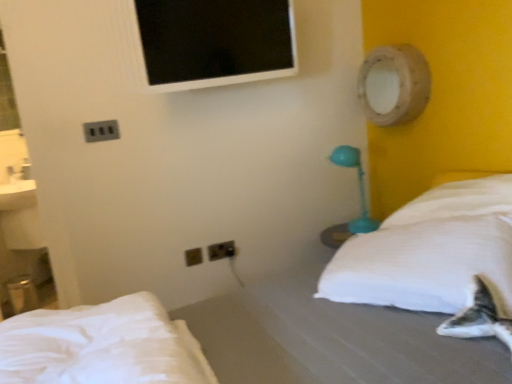
This screenshot has height=384, width=512. Find the location of `metallic socket at upper left, which is the first electric outlet from front to back`. metallic socket at upper left, which is the first electric outlet from front to back is located at coordinates (101, 131).

The height and width of the screenshot is (384, 512). Describe the element at coordinates (101, 131) in the screenshot. I see `metallic socket at upper left, which is the third electric outlet in bottom-to-top order` at that location.

What are the coordinates of `black plastic electric outlet at lower center, which ranks as the 2th electric outlet in right-to-left order` in the screenshot? It's located at (193, 257).

Identify the location of white fabric bed at center, positioned as the 2th bed in top-to-bottom order. This screenshot has width=512, height=384. (248, 340).

Is black plastic outlet at lower center, which is the second electric outlet in bottom-to-top order, wider or thinner than black plastic electric outlet at lower center, which ranks as the 2th electric outlet in right-to-left order?

black plastic outlet at lower center, which is the second electric outlet in bottom-to-top order, is thinner than black plastic electric outlet at lower center, which ranks as the 2th electric outlet in right-to-left order.

Is black plastic outlet at lower center, the 1th electric outlet positioned from the right, to the left or to the right of black plastic electric outlet at lower center, the second electric outlet viewed from the back, in the image?

Clearly, black plastic outlet at lower center, the 1th electric outlet positioned from the right, is on the right of black plastic electric outlet at lower center, the second electric outlet viewed from the back, in the image.

Choose the correct answer: Is black plastic outlet at lower center, marked as the third electric outlet in a left-to-right arrangement, inside black plastic electric outlet at lower center, which is counted as the 2th electric outlet, starting from the left, or outside it?

black plastic outlet at lower center, marked as the third electric outlet in a left-to-right arrangement, lies outside black plastic electric outlet at lower center, which is counted as the 2th electric outlet, starting from the left.

From a real-world perspective, who is located higher, white fabric bed at center, positioned as the 2th bed in top-to-bottom order, or teal plastic table lamp at right?

teal plastic table lamp at right is physically above.

Visually, is white fabric bed at center, arranged as the 1th bed when ordered from the bottom, positioned to the left or to the right of teal plastic table lamp at right?

white fabric bed at center, arranged as the 1th bed when ordered from the bottom, is to the left of teal plastic table lamp at right.

Where is `the 2nd bed positioned below the teal plastic table lamp at right (from a real-world perspective)`? This screenshot has height=384, width=512. the 2nd bed positioned below the teal plastic table lamp at right (from a real-world perspective) is located at coordinates (248, 340).

How many degrees apart are the facing directions of white fabric bed at center, positioned as the 2th bed in top-to-bottom order, and teal plastic table lamp at right?

white fabric bed at center, positioned as the 2th bed in top-to-bottom order, and teal plastic table lamp at right are facing 1.43 degrees away from each other.

Is white fabric bed at center, positioned as the 2th bed in top-to-bottom order, not close to wooden round mirror at upper right?

Yes.

Is white fabric bed at center, positioned as the 2th bed in top-to-bottom order, positioned in front of wooden round mirror at upper right?

That is True.

From the image's perspective, which is above, white fabric bed at center, arranged as the 1th bed when ordered from the bottom, or wooden round mirror at upper right?

wooden round mirror at upper right appears higher in the image.

Considering the sizes of objects white fabric bed at center, positioned as the 2th bed in top-to-bottom order, and wooden round mirror at upper right in the image provided, who is wider, white fabric bed at center, positioned as the 2th bed in top-to-bottom order, or wooden round mirror at upper right?

Wider between the two is white fabric bed at center, positioned as the 2th bed in top-to-bottom order.

Is white soft bed at lower left, placed as the 2th bed when sorted from bottom to top, with teal plastic table lamp at right?

No, white soft bed at lower left, placed as the 2th bed when sorted from bottom to top, is not making contact with teal plastic table lamp at right.

Does white soft bed at lower left, placed as the 2th bed when sorted from bottom to top, lie in front of teal plastic table lamp at right?

Yes, it is in front of teal plastic table lamp at right.

From the image's perspective, is white soft bed at lower left, which ranks as the 1th bed in top-to-bottom order, beneath teal plastic table lamp at right?

Yes, from the image's perspective, white soft bed at lower left, which ranks as the 1th bed in top-to-bottom order, is beneath teal plastic table lamp at right.

From a real-world perspective, between white soft bed at lower left, which ranks as the 1th bed in top-to-bottom order, and teal plastic table lamp at right, who is vertically higher?

teal plastic table lamp at right is physically above.

Considering the sizes of objects white fabric bed at center, arranged as the 1th bed when ordered from the bottom, and white soft pillow at right in the image provided, who is shorter, white fabric bed at center, arranged as the 1th bed when ordered from the bottom, or white soft pillow at right?

Standing shorter between the two is white soft pillow at right.

In the scene shown: Which object is positioned more to the left, white fabric bed at center, positioned as the 2th bed in top-to-bottom order, or white soft pillow at right?

white fabric bed at center, positioned as the 2th bed in top-to-bottom order, is more to the left.

Consider the image. Considering the positions of objects white fabric bed at center, arranged as the 1th bed when ordered from the bottom, and white soft pillow at right in the image provided, who is in front, white fabric bed at center, arranged as the 1th bed when ordered from the bottom, or white soft pillow at right?

white fabric bed at center, arranged as the 1th bed when ordered from the bottom, is more forward.

From a real-world perspective, who is located lower, metallic socket at upper left, which is the third electric outlet in bottom-to-top order, or white soft bed at lower left, which ranks as the 1th bed in top-to-bottom order?

white soft bed at lower left, which ranks as the 1th bed in top-to-bottom order.

Looking at this image, how different are the orientations of metallic socket at upper left, which is the third electric outlet in bottom-to-top order, and white soft bed at lower left, which ranks as the 1th bed in top-to-bottom order, in degrees?

There is a 90.4-degree angle between the facing directions of metallic socket at upper left, which is the third electric outlet in bottom-to-top order, and white soft bed at lower left, which ranks as the 1th bed in top-to-bottom order.

Between metallic socket at upper left, which is the third electric outlet in bottom-to-top order, and white soft bed at lower left, which ranks as the 1th bed in top-to-bottom order, which one appears on the right side from the viewer's perspective?

Positioned to the right is white soft bed at lower left, which ranks as the 1th bed in top-to-bottom order.

How distant is metallic socket at upper left, the first electric outlet viewed from the left, from white soft bed at lower left, placed as the 2th bed when sorted from bottom to top?

metallic socket at upper left, the first electric outlet viewed from the left, and white soft bed at lower left, placed as the 2th bed when sorted from bottom to top, are 1.04 meters apart.

Considering the sizes of metallic socket at upper left, which is the third electric outlet in bottom-to-top order, and white soft pillow at right in the image, is metallic socket at upper left, which is the third electric outlet in bottom-to-top order, wider or thinner than white soft pillow at right?

Clearly, metallic socket at upper left, which is the third electric outlet in bottom-to-top order, has less width compared to white soft pillow at right.

Based on their positions, is metallic socket at upper left, which is the third electric outlet in bottom-to-top order, located to the left or right of white soft pillow at right?

Based on their positions, metallic socket at upper left, which is the third electric outlet in bottom-to-top order, is located to the left of white soft pillow at right.

Between metallic socket at upper left, the first electric outlet viewed from the left, and white soft pillow at right, which one is positioned behind?

metallic socket at upper left, the first electric outlet viewed from the left, is more distant.

Image resolution: width=512 pixels, height=384 pixels. I want to click on pillow that is in front of the metallic socket at upper left, the 1th electric outlet from the top, so click(x=431, y=251).

The image size is (512, 384). Find the location of `electric outlet below the black plastic electric outlet at lower center, the second electric outlet viewed from the back (from a real-world perspective)`. electric outlet below the black plastic electric outlet at lower center, the second electric outlet viewed from the back (from a real-world perspective) is located at coordinates (221, 250).

What are the coordinates of `bed that is the 1st object to the left of the teal plastic table lamp at right, starting at the anchor` in the screenshot? It's located at (248, 340).

Considering their positions, is white soft bed at lower left, placed as the 2th bed when sorted from bottom to top, positioned further to white fabric bed at center, arranged as the 1th bed when ordered from the bottom, than teal plastic table lamp at right?

Among the two, teal plastic table lamp at right is located further to white fabric bed at center, arranged as the 1th bed when ordered from the bottom.

Looking at the image, which one is located further to white fabric bed at center, arranged as the 1th bed when ordered from the bottom, teal plastic table lamp at right or metallic socket at upper left, which is the third electric outlet in bottom-to-top order?

Among the two, metallic socket at upper left, which is the third electric outlet in bottom-to-top order, is located further to white fabric bed at center, arranged as the 1th bed when ordered from the bottom.

Looking at the image, which one is located closer to teal plastic table lamp at right, white soft pillow at right or metallic socket at upper left, the third electric outlet positioned from the back?

Among the two, white soft pillow at right is located nearer to teal plastic table lamp at right.

Considering their positions, is teal plastic table lamp at right positioned closer to black plastic outlet at lower center, the 1th electric outlet positioned from the right, than white fabric bed at center, arranged as the 1th bed when ordered from the bottom?

teal plastic table lamp at right is positioned closer to the anchor black plastic outlet at lower center, the 1th electric outlet positioned from the right.

Estimate the real-world distances between objects in this image. Which object is further from black plastic outlet at lower center, the 2th electric outlet when ordered from top to bottom, white soft pillow at right or wooden round mirror at upper right?

Based on the image, wooden round mirror at upper right appears to be further to black plastic outlet at lower center, the 2th electric outlet when ordered from top to bottom.

When comparing their distances from white soft pillow at right, does white fabric bed at center, arranged as the 1th bed when ordered from the bottom, or metallic socket at upper left, the first electric outlet viewed from the left, seem further?

metallic socket at upper left, the first electric outlet viewed from the left, lies further to white soft pillow at right than the other object.

Considering their positions, is white soft pillow at right positioned further to white fabric bed at center, arranged as the 1th bed when ordered from the bottom, than wooden round mirror at upper right?

The object further to white fabric bed at center, arranged as the 1th bed when ordered from the bottom, is wooden round mirror at upper right.

Estimate the real-world distances between objects in this image. Which object is further from white fabric bed at center, positioned as the 2th bed in top-to-bottom order, black plastic outlet at lower center, which is the second electric outlet in bottom-to-top order, or teal plastic table lamp at right?

teal plastic table lamp at right.

This screenshot has height=384, width=512. I want to click on bed between white fabric bed at center, positioned as the 2th bed in top-to-bottom order, and wooden round mirror at upper right from front to back, so click(x=102, y=346).

Where is `table lamp between white soft bed at lower left, which ranks as the 1th bed in top-to-bottom order, and black plastic electric outlet at lower center, which ranks as the 2th electric outlet in right-to-left order, in the front-back direction`? table lamp between white soft bed at lower left, which ranks as the 1th bed in top-to-bottom order, and black plastic electric outlet at lower center, which ranks as the 2th electric outlet in right-to-left order, in the front-back direction is located at coordinates (358, 184).

In order to click on mirror positioned between white fabric bed at center, positioned as the 2th bed in top-to-bottom order, and black plastic electric outlet at lower center, the second electric outlet viewed from the back, from near to far in this screenshot , I will do `click(394, 85)`.

I want to click on electric outlet between metallic socket at upper left, the third electric outlet positioned from the back, and black plastic electric outlet at lower center, positioned as the first electric outlet in bottom-to-top order, vertically, so click(x=221, y=250).